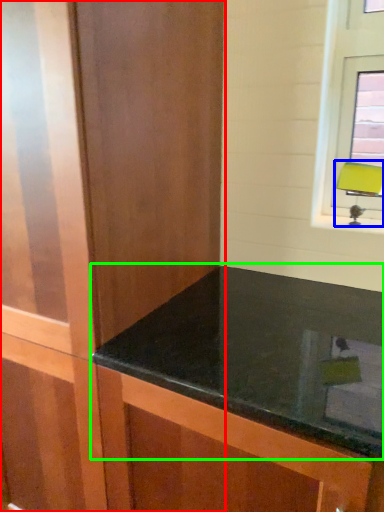
Question: Which object is positioned closest to dresser (highlighted by a red box)? Select from table lamp (highlighted by a blue box) and countertop (highlighted by a green box).

Choices:
 (A) table lamp
 (B) countertop

Answer: (B)